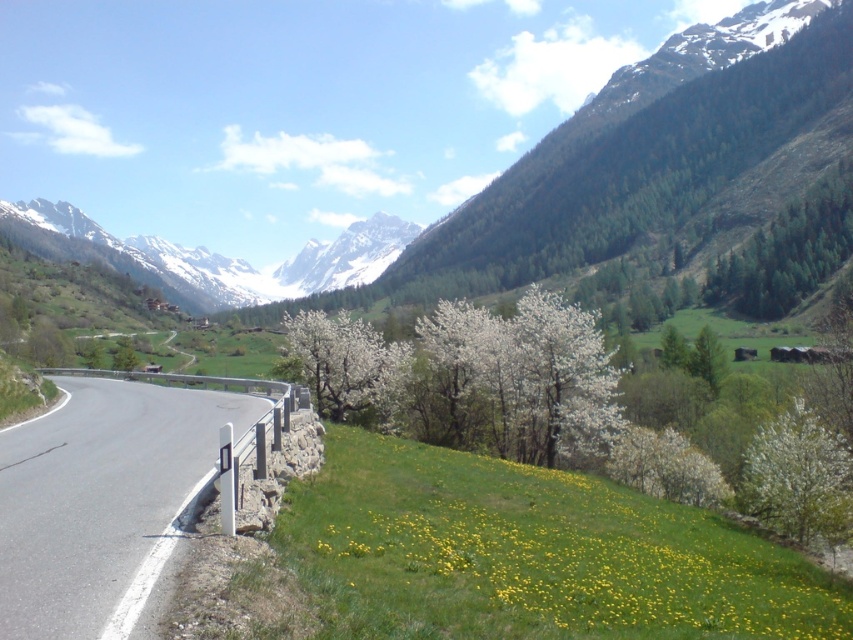
Describe the element at coordinates (627, 160) in the screenshot. I see `green forested mountain at upper center` at that location.

From the picture: Does green forested mountain at upper center have a lesser width compared to snowy granite mountains at upper center?

No.

Which is in front, point (718, 72) or point (154, 266)?

Point (718, 72)

Where is `green forested mountain at upper center`? green forested mountain at upper center is located at coordinates (627, 160).

Which of these two, yellow grass at lower right or green textured trees at upper right, stands shorter?

yellow grass at lower right

What are the coordinates of `yellow grass at lower right` in the screenshot? It's located at (564, 570).

At what (x,y) coordinates should I click in order to perform the action: click on yellow grass at lower right. Please return your answer as a coordinate pair (x, y). This screenshot has height=640, width=853. Looking at the image, I should click on (564, 570).

Identify the location of asphalt road at lower left. Image resolution: width=853 pixels, height=640 pixels. (102, 500).

Can you confirm if asphalt road at lower left is positioned below green textured trees at upper right?

Correct, asphalt road at lower left is located below green textured trees at upper right.

Locate an element on the screen. The height and width of the screenshot is (640, 853). asphalt road at lower left is located at coordinates (102, 500).